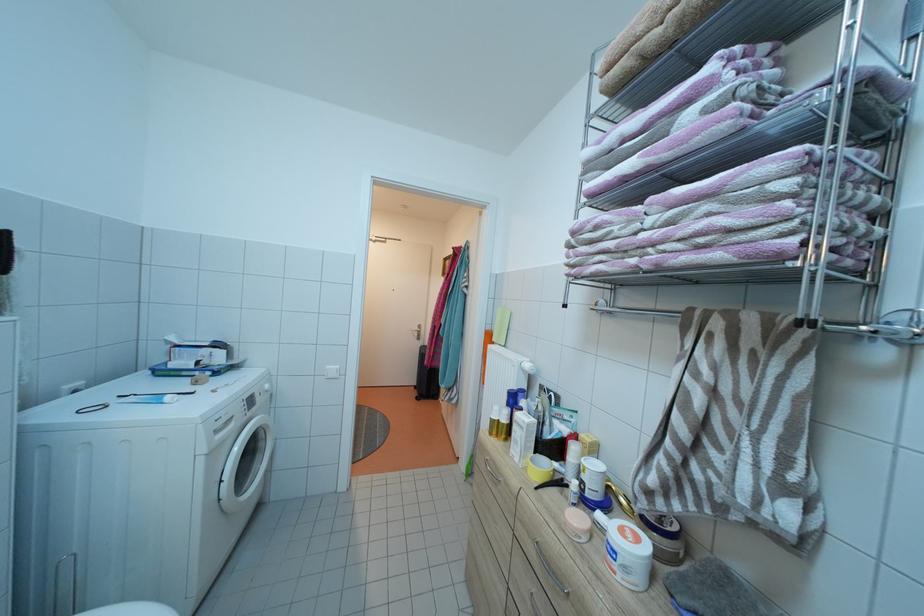
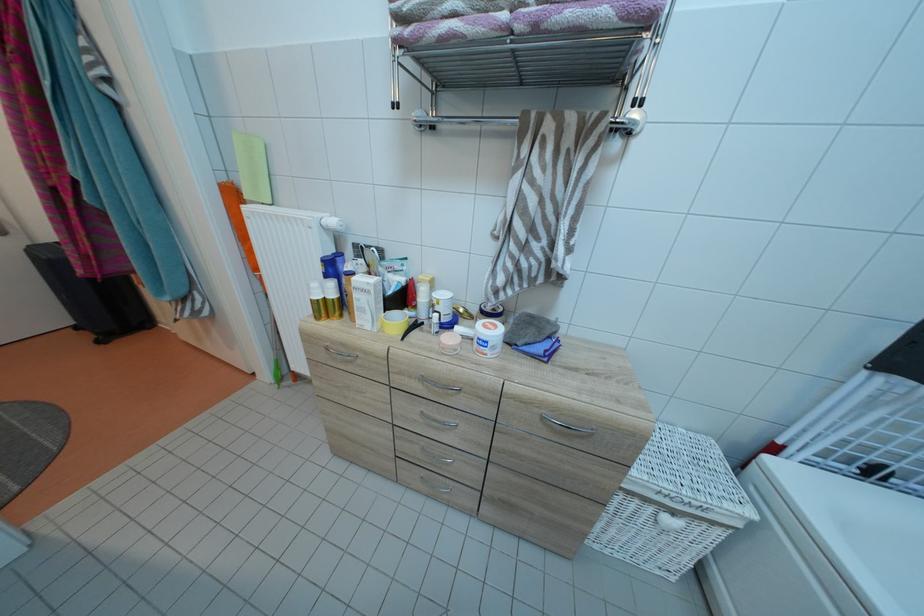
Find the pixel in the second image that matches (x=514, y=416) in the first image.

(338, 290)